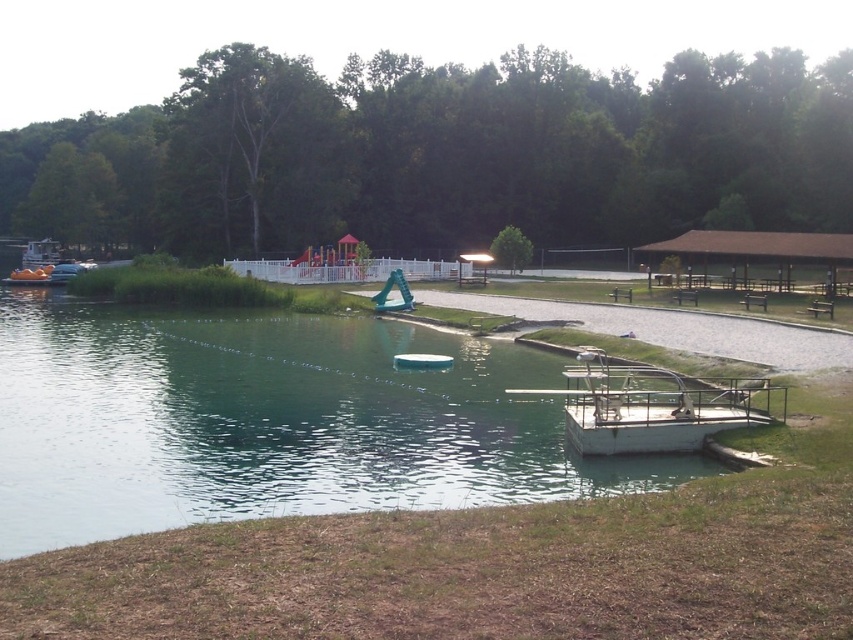
Does green metallic dock at lower right have a lesser width compared to white plastic boat at center?

Incorrect, green metallic dock at lower right's width is not less than white plastic boat at center's.

Does green metallic dock at lower right have a greater width compared to white plastic boat at center?

Indeed, green metallic dock at lower right has a greater width compared to white plastic boat at center.

Between point (471, 337) and point (405, 356), which one is positioned behind?

Positioned behind is point (471, 337).

Locate an element on the screen. green metallic dock at lower right is located at coordinates (267, 420).